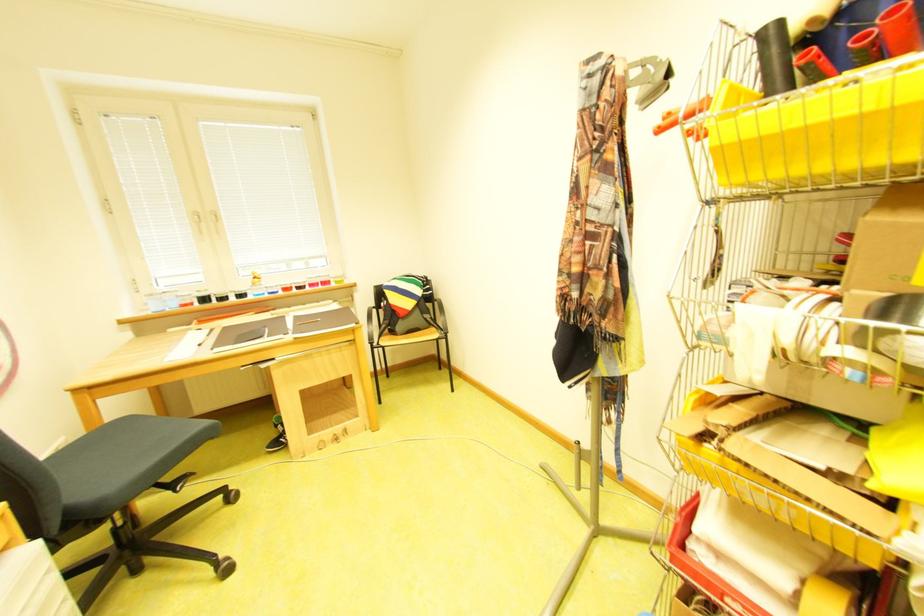
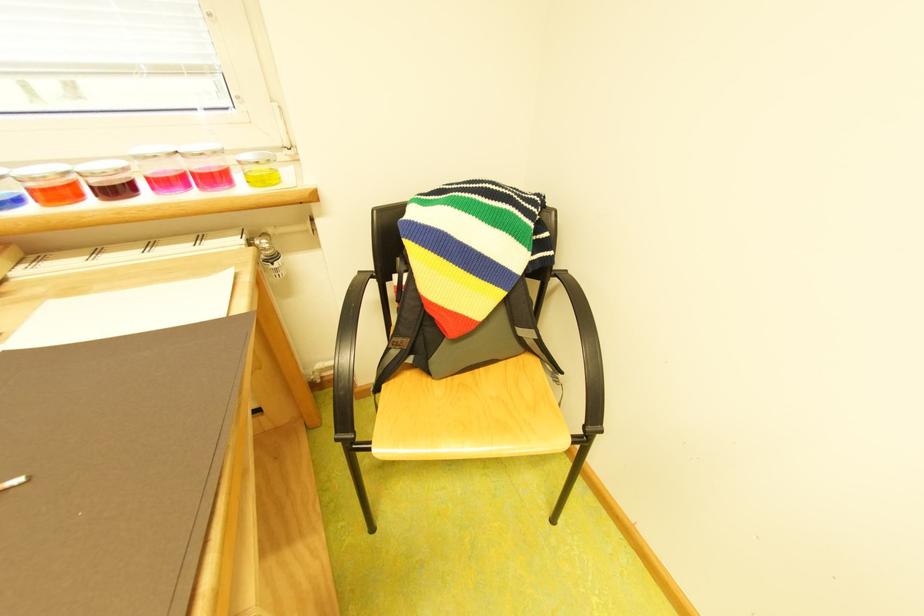
Question: The images are taken continuously from a first-person perspective. In which direction are you moving?

Choices:
 (A) Left
 (B) Right
 (C) Forward
 (D) Backward

Answer: (C)